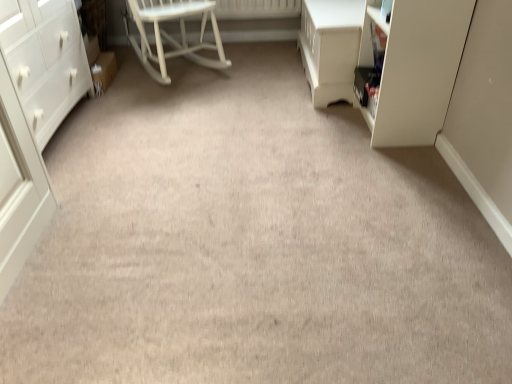
Question: Is white glossy vanity at upper right thinner than white matte chest of drawers at left?

Choices:
 (A) yes
 (B) no

Answer: (A)

Question: From a real-world perspective, is white glossy vanity at upper right physically below white matte chest of drawers at left?

Choices:
 (A) no
 (B) yes

Answer: (B)

Question: Can you confirm if white glossy vanity at upper right is smaller than white matte chest of drawers at left?

Choices:
 (A) yes
 (B) no

Answer: (A)

Question: Is white glossy vanity at upper right at the left side of white matte chest of drawers at left?

Choices:
 (A) yes
 (B) no

Answer: (B)

Question: Is white glossy vanity at upper right not near white matte chest of drawers at left?

Choices:
 (A) yes
 (B) no

Answer: (A)

Question: From a real-world perspective, is white matte chest of drawers at left above or below white glossy vanity at upper right?

Choices:
 (A) below
 (B) above

Answer: (B)

Question: Is white matte chest of drawers at left spatially inside white glossy vanity at upper right, or outside of it?

Choices:
 (A) inside
 (B) outside

Answer: (B)

Question: Based on their sizes in the image, would you say white matte chest of drawers at left is bigger or smaller than white glossy vanity at upper right?

Choices:
 (A) big
 (B) small

Answer: (A)

Question: Considering the positions of point (42, 56) and point (330, 46), is point (42, 56) closer or farther from the camera than point (330, 46)?

Choices:
 (A) farther
 (B) closer

Answer: (B)

Question: Considering their positions, is white glossy vanity at upper right located in front of or behind matte white cabinet at right?

Choices:
 (A) behind
 (B) front

Answer: (A)

Question: From a real-world perspective, relative to matte white cabinet at right, is white glossy vanity at upper right vertically above or below?

Choices:
 (A) below
 (B) above

Answer: (A)

Question: In terms of width, does white glossy vanity at upper right look wider or thinner when compared to matte white cabinet at right?

Choices:
 (A) thin
 (B) wide

Answer: (B)

Question: Choose the correct answer: Is white glossy vanity at upper right inside matte white cabinet at right or outside it?

Choices:
 (A) outside
 (B) inside

Answer: (A)

Question: From a real-world perspective, is matte white cabinet at right physically located above or below white glossy vanity at upper right?

Choices:
 (A) above
 (B) below

Answer: (A)

Question: In terms of size, does matte white cabinet at right appear bigger or smaller than white glossy vanity at upper right?

Choices:
 (A) small
 (B) big

Answer: (A)